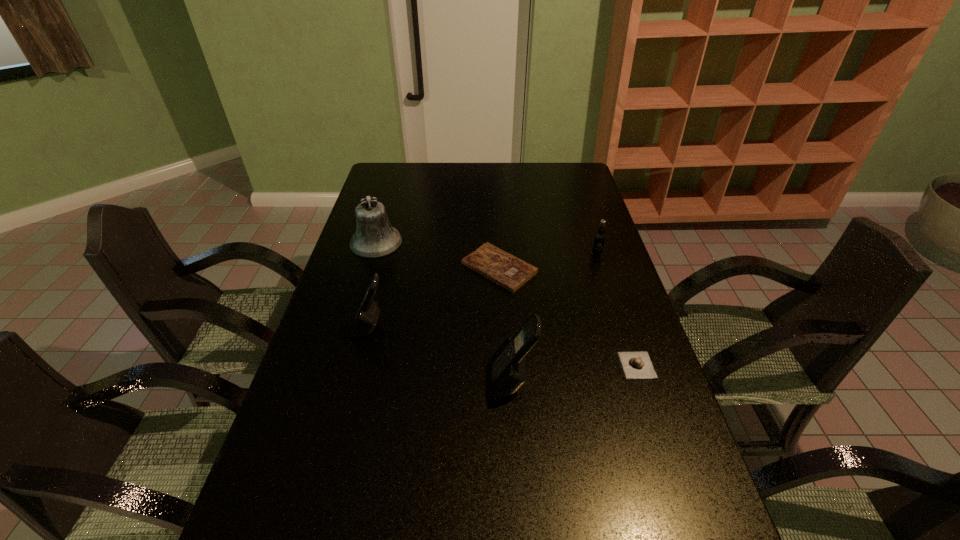
Locate an element on the screen. Image resolution: width=960 pixels, height=540 pixels. the farther cellular telephone is located at coordinates (366, 318).

The image size is (960, 540). I want to click on the left cellular telephone, so click(x=366, y=318).

Locate an element on the screen. The image size is (960, 540). the tallest object is located at coordinates (506, 372).

Where is `the right cellular telephone`? The image size is (960, 540). the right cellular telephone is located at coordinates (506, 372).

Find the location of a particular element. This screenshot has width=960, height=540. root beer is located at coordinates (599, 239).

You are a GUI agent. You are given a task and a screenshot of the screen. Output one action in this format:
    pyautogui.click(x=<x>, y=<y>)
    Task: Click on the shortest object
    The image size is (960, 540).
    Given the screenshot: What is the action you would take?
    pyautogui.click(x=495, y=264)

At what (x,y) coordinates should I click in order to perform the action: click on garlic. Please return your answer as a coordinate pair (x, y). Looking at the image, I should click on (636, 364).

Identify the location of bell. The width and height of the screenshot is (960, 540). (375, 237).

Locate an element on the screen. The image size is (960, 540). vacant area situated on the front-facing side of the farther cellular telephone is located at coordinates point(321,327).

This screenshot has width=960, height=540. Identify the location of vacant space located on the front-facing side of the farther cellular telephone. (321, 327).